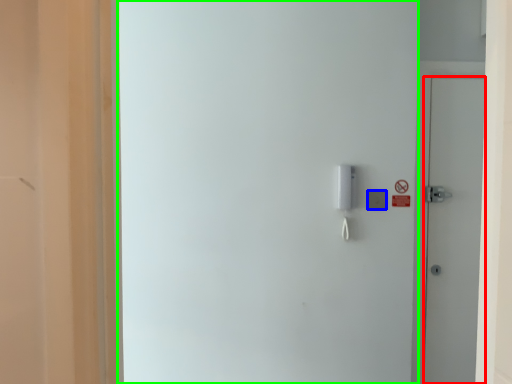
Question: Which object is the farthest from door (highlighted by a red box)? Choose among these: light switch (highlighted by a blue box) or screen door (highlighted by a green box).

Choices:
 (A) light switch
 (B) screen door

Answer: (B)